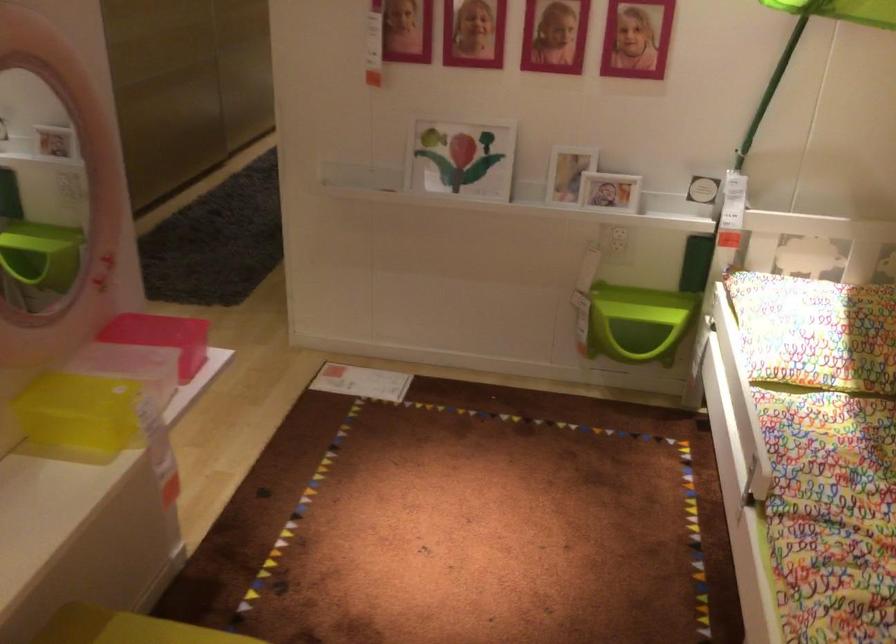
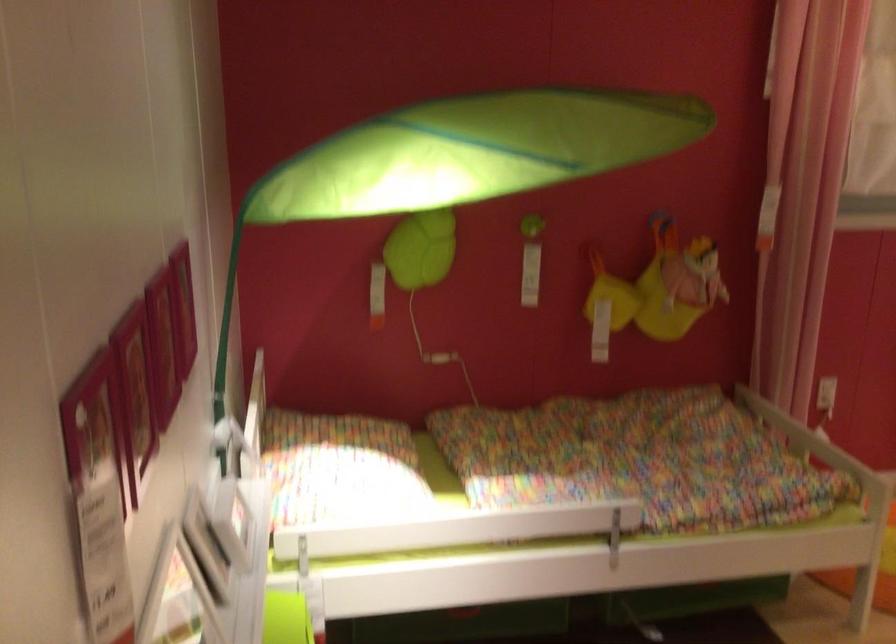
In the second image, find the point that corresponds to (762,93) in the first image.

(226, 339)